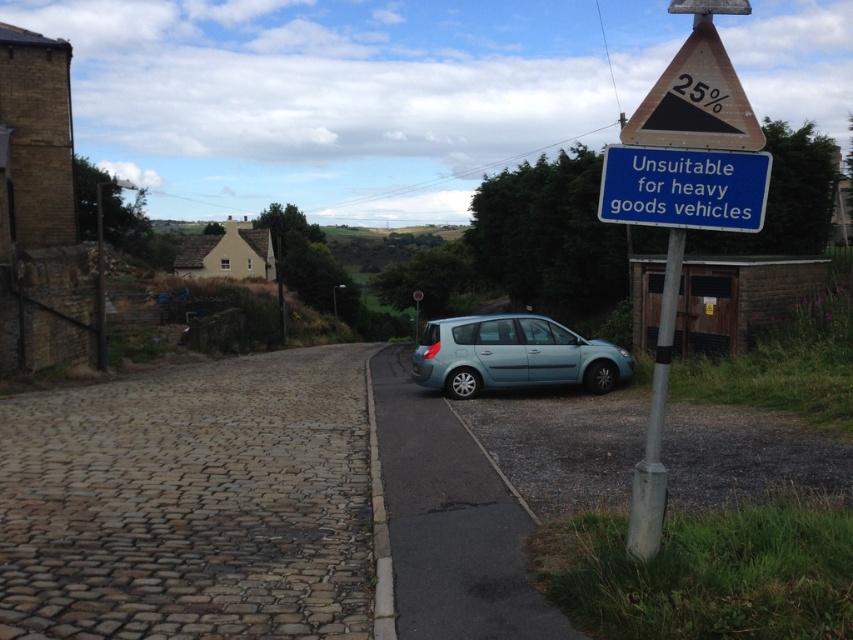
You are driving a delivery van that is 2.5 meters wide. You need to pass through the area between the blue metallic sign at upper right and the wooden triangular sign at upper right. Can your van fit through the space between them?

The blue metallic sign at upper right has a lesser width compared to wooden triangular sign at upper right. However, the width of the signs themselves does not directly indicate the available space between them. Without information about the distance between the two signs, it is impossible to determine if the van can fit through the space.

You are driving a car and see the blue metallic sign at upper right and the wooden triangular sign at upper right on the side of the road. Which one is positioned lower?

The blue metallic sign at upper right is positioned lower than the wooden triangular sign at upper right because it is located below it.